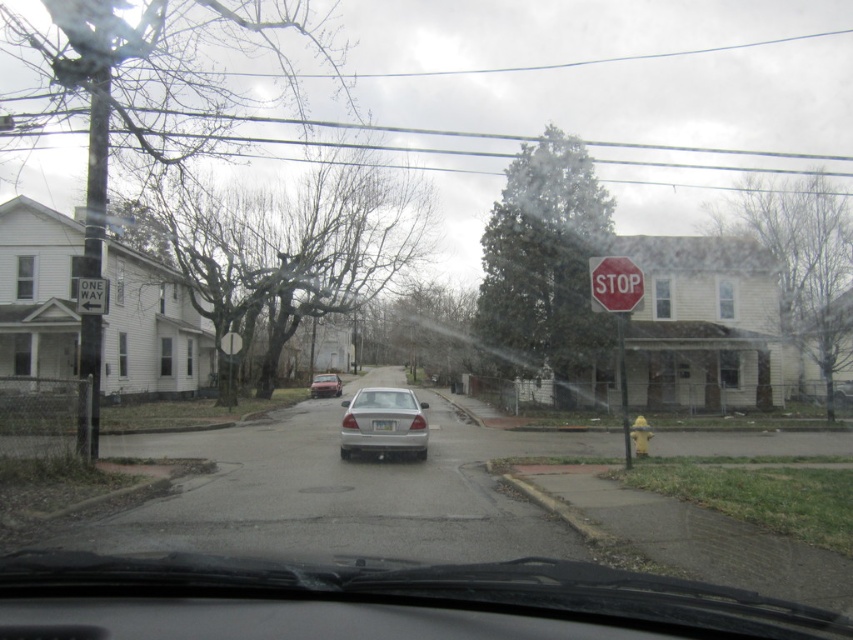
Question: Which object is farther from the camera taking this photo?

Choices:
 (A) silver metallic sedan at center
 (B) transparent rubber windshield at center
 (C) matte silver sedan at center

Answer: (C)

Question: Is silver metallic sedan at center further to the viewer compared to matte silver sedan at center?

Choices:
 (A) yes
 (B) no

Answer: (B)

Question: Considering the real-world distances, which object is closest to the transparent rubber windshield at center?

Choices:
 (A) matte silver sedan at center
 (B) silver metallic sedan at center
 (C) white plastic one way sign at upper left
 (D) clear glass windshield at center

Answer: (C)

Question: Is red matte stop sign at upper right wider than white plastic one way sign at upper left?

Choices:
 (A) no
 (B) yes

Answer: (B)

Question: Estimate the real-world distances between objects in this image. Which object is closer to the matte silver sedan at center?

Choices:
 (A) white plastic one way sign at upper left
 (B) transparent rubber windshield at center

Answer: (A)

Question: Is red matte stop sign at upper right closer to the viewer compared to matte silver sedan at center?

Choices:
 (A) yes
 (B) no

Answer: (A)